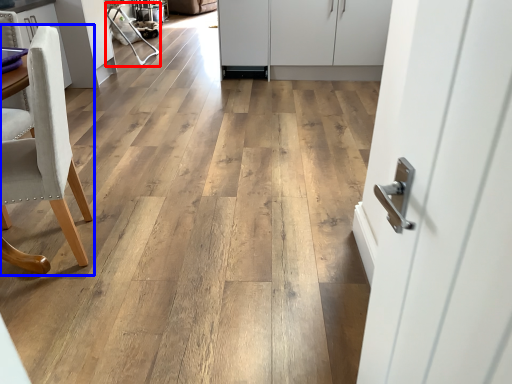
Question: Among these objects, which one is nearest to the camera, armchair (highlighted by a red box) or chair (highlighted by a blue box)?

Choices:
 (A) armchair
 (B) chair

Answer: (B)